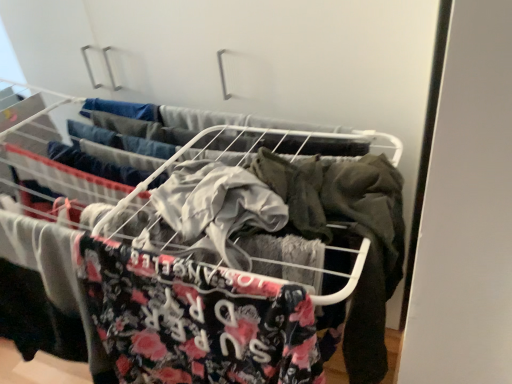
Question: Is metal wire rack at center positioned behind gray fabric shirt at center?

Choices:
 (A) no
 (B) yes

Answer: (A)

Question: Is metal wire rack at center smaller than gray fabric shirt at center?

Choices:
 (A) no
 (B) yes

Answer: (A)

Question: Can you confirm if metal wire rack at center is wider than gray fabric shirt at center?

Choices:
 (A) yes
 (B) no

Answer: (A)

Question: Is metal wire rack at center far away from gray fabric shirt at center?

Choices:
 (A) yes
 (B) no

Answer: (B)

Question: Can you confirm if metal wire rack at center is positioned to the right of gray fabric shirt at center?

Choices:
 (A) yes
 (B) no

Answer: (A)

Question: Could you tell me if metal wire rack at center is facing gray fabric shirt at center?

Choices:
 (A) yes
 (B) no

Answer: (B)

Question: From the image's perspective, is gray fabric shirt at center on top of metal wire rack at center?

Choices:
 (A) no
 (B) yes

Answer: (B)

Question: Is gray fabric shirt at center to the right of metal wire rack at center from the viewer's perspective?

Choices:
 (A) no
 (B) yes

Answer: (A)

Question: Does gray fabric shirt at center have a smaller size compared to metal wire rack at center?

Choices:
 (A) yes
 (B) no

Answer: (A)

Question: Could metal wire rack at center be considered to be inside gray fabric shirt at center?

Choices:
 (A) yes
 (B) no

Answer: (B)

Question: Is gray fabric shirt at center in front of metal wire rack at center?

Choices:
 (A) yes
 (B) no

Answer: (B)

Question: From a real-world perspective, is gray fabric shirt at center over metal wire rack at center?

Choices:
 (A) yes
 (B) no

Answer: (B)

Question: In the image, is gray fabric shirt at center positioned in front of or behind metal wire rack at center?

Choices:
 (A) front
 (B) behind

Answer: (B)